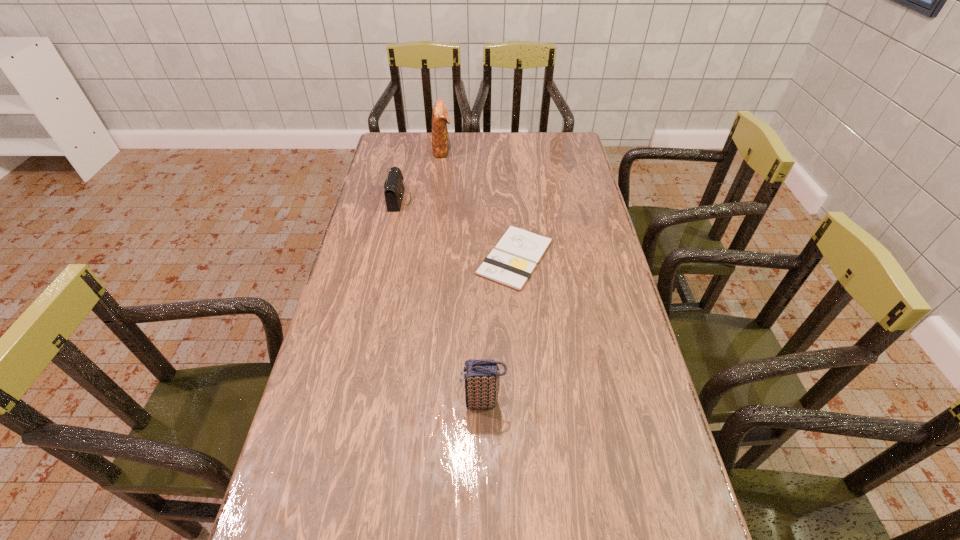
I want to click on free location at the far right corner of the desktop, so click(540, 137).

The width and height of the screenshot is (960, 540). What are the coordinates of `free area in between the rightmost clutch bag and the third nearest object` in the screenshot? It's located at (442, 301).

The height and width of the screenshot is (540, 960). Find the location of `free area in between the second farthest clutch bag and the farthest clutch bag`. free area in between the second farthest clutch bag and the farthest clutch bag is located at coordinates (420, 174).

Where is `free space between the notepad and the leftmost object`? free space between the notepad and the leftmost object is located at coordinates (457, 228).

This screenshot has height=540, width=960. Identify the location of free point between the nearest clutch bag and the leftmost object. (442, 301).

At what (x,y) coordinates should I click in order to perform the action: click on vacant point located between the shortest object and the second nearest clutch bag. Please return your answer as a coordinate pair (x, y). The width and height of the screenshot is (960, 540). Looking at the image, I should click on (457, 228).

This screenshot has width=960, height=540. Find the location of `vacant area that lies between the leftmost clutch bag and the shortest object`. vacant area that lies between the leftmost clutch bag and the shortest object is located at coordinates click(x=457, y=228).

Where is `free space between the nearest object and the second clutch bag from right to left`? The image size is (960, 540). free space between the nearest object and the second clutch bag from right to left is located at coordinates (463, 276).

Where is `unoccupied position between the shortest object and the farthest clutch bag`? unoccupied position between the shortest object and the farthest clutch bag is located at coordinates (479, 204).

Where is `vacant area between the nearest clutch bag and the second nearest clutch bag`? The width and height of the screenshot is (960, 540). vacant area between the nearest clutch bag and the second nearest clutch bag is located at coordinates (442, 301).